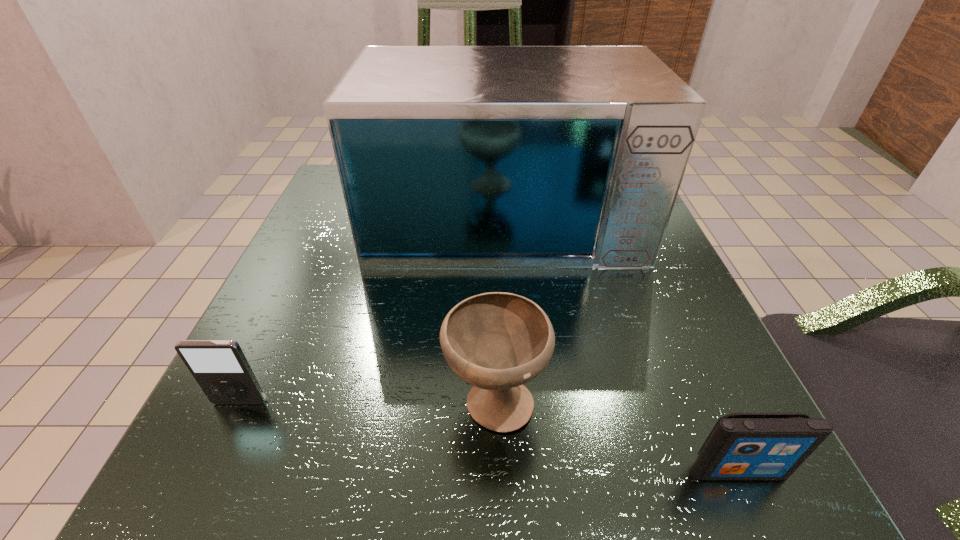
Locate an element on the screen. The width and height of the screenshot is (960, 540). the tallest object is located at coordinates (448, 156).

Image resolution: width=960 pixels, height=540 pixels. I want to click on the farthest object, so click(x=448, y=156).

Identify the location of chalice. The height and width of the screenshot is (540, 960). (496, 341).

The width and height of the screenshot is (960, 540). Find the location of `the left iPod`. the left iPod is located at coordinates (221, 369).

Locate an element on the screen. The image size is (960, 540). the farther iPod is located at coordinates (221, 369).

The height and width of the screenshot is (540, 960). Find the location of `the nearer iPod`. the nearer iPod is located at coordinates (741, 446).

Where is `the nearest object`? The width and height of the screenshot is (960, 540). the nearest object is located at coordinates (741, 446).

Image resolution: width=960 pixels, height=540 pixels. I want to click on blank space located 0.100m on the front-facing side of the microwave oven, so click(510, 306).

Find the location of a particular element. vacant space positioned 0.290m on the left of the third shortest object is located at coordinates (233, 400).

The height and width of the screenshot is (540, 960). I want to click on vacant space located on the front-facing side of the left iPod, so click(x=191, y=506).